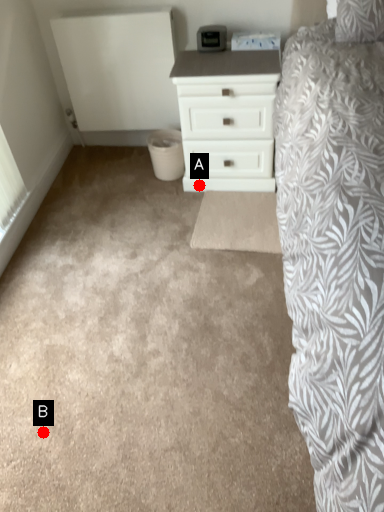
Question: Two points are circled on the image, labeled by A and B beside each circle. Among these points, which one is nearest to the camera?

Choices:
 (A) A is closer
 (B) B is closer

Answer: (B)